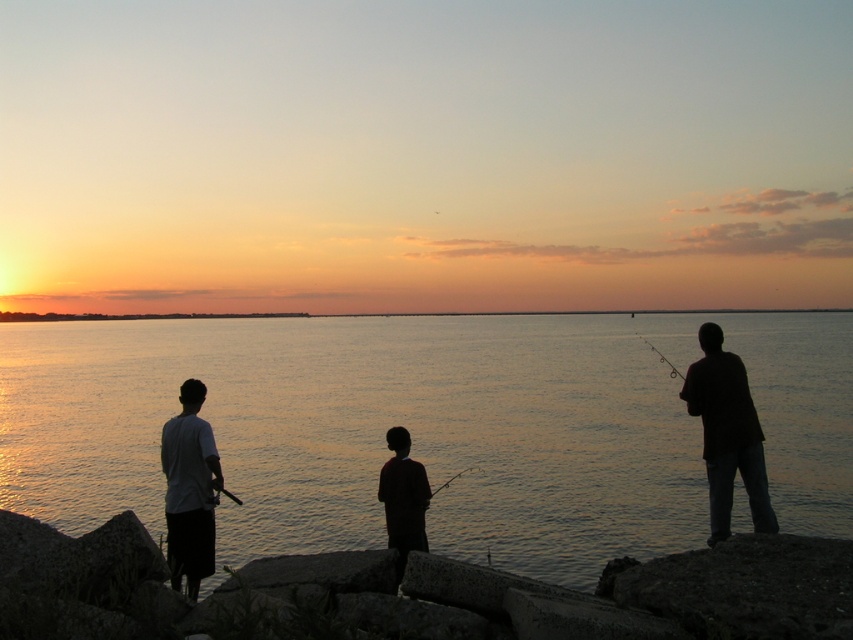
Can you confirm if silvery water at center is smaller than metallic fishing pole at right?

Incorrect, silvery water at center is not smaller in size than metallic fishing pole at right.

Which is in front, point (409, 406) or point (656, 353)?

Point (656, 353)

Between point (619, 468) and point (679, 372), which one is positioned in front?

Positioned in front is point (679, 372).

This screenshot has height=640, width=853. Identify the location of silvery water at center. 425,428.

Does white matte shirt at left appear under smooth black rod at center?

Incorrect, white matte shirt at left is not positioned below smooth black rod at center.

Who is positioned more to the right, white matte shirt at left or smooth black rod at center?

smooth black rod at center

Which is in front, point (190, 586) or point (437, 488)?

Point (190, 586)

Image resolution: width=853 pixels, height=640 pixels. Identify the location of white matte shirt at left. (189, 490).

This screenshot has width=853, height=640. In order to click on white matte shirt at left in this screenshot , I will do `click(189, 490)`.

Who is higher up, white matte shirt at left or black matte shirt at center?

white matte shirt at left

You are a GUI agent. You are given a task and a screenshot of the screen. Output one action in this format:
    pyautogui.click(x=<x>, y=<y>)
    Task: Click on the white matte shirt at left
    The width and height of the screenshot is (853, 640).
    Given the screenshot: What is the action you would take?
    pyautogui.click(x=189, y=490)

What are the coordinates of `white matte shirt at left` in the screenshot? It's located at (189, 490).